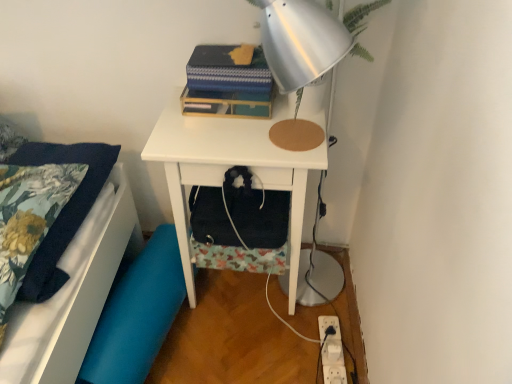
You are a GUI agent. You are given a task and a screenshot of the screen. Output one action in this format:
    pyautogui.click(x=<x>, y=<y>)
    Task: Click on the vacant region to the left of silver metallic lamp at upper center
    
    Given the screenshot: What is the action you would take?
    pyautogui.click(x=215, y=129)